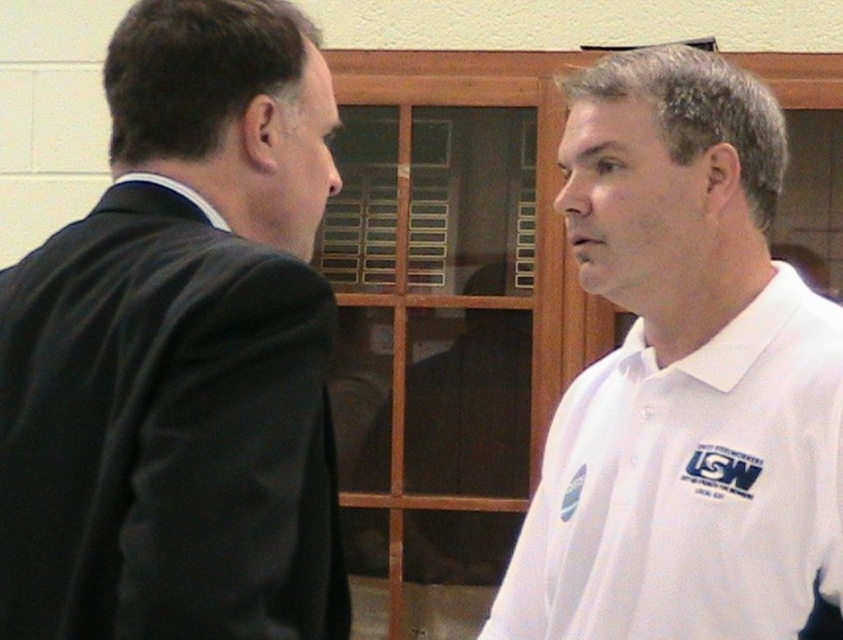
You are a social distancing monitor in a workplace. According to the image, is the distance between the black suit at left and the white cotton polo shirt at right compliant with the 1 meter social distancing guideline?

The distance between the black suit at left and the white cotton polo shirt at right is 1.01 meters, which is slightly over the 1 meter guideline, so it is compliant.

In the scene shown: You are an event planner arranging a photo shoot. You need to position two models wearing the black suit at left and white cotton polo shirt at right so that their outfits are visible in the frame. Based on the scene, which model should stand higher to ensure their clothing is clearly seen?

The black suit at left should be positioned higher than the white cotton polo shirt at right to ensure their clothing is clearly visible, as the black suit at left is above the white cotton polo shirt at right in the original scene.

From the picture: You are an event planner arranging a meeting between two guests. One guest is wearing a black suit at left, and the other is wearing a white cotton polo shirt at right. You need to seat them so the taller guest sits in the center of the table. Which guest should you seat there?

The black suit at left is taller than the white cotton polo shirt at right, so you should seat the guest wearing the black suit at left in the center of the table.